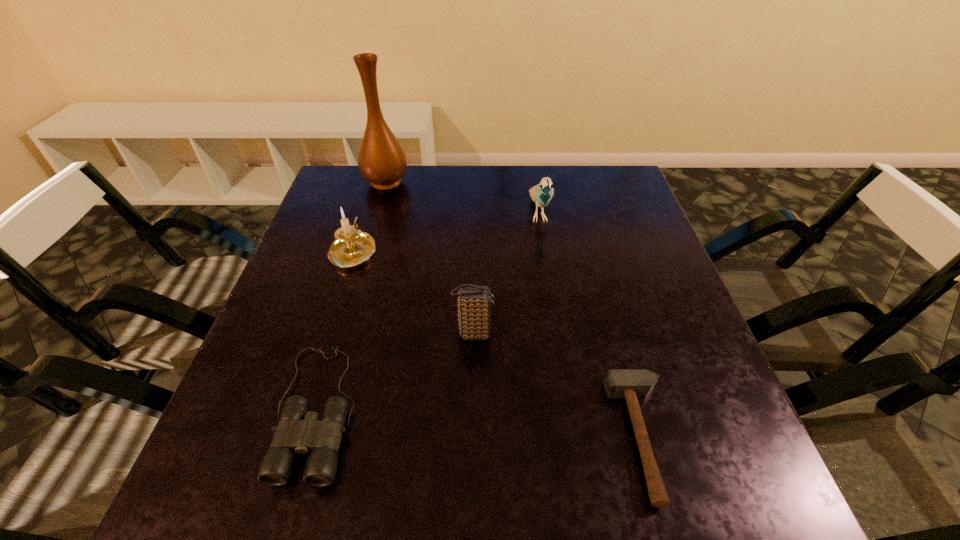
Locate an element on the screen. This screenshot has width=960, height=540. free space at the left edge of the desktop is located at coordinates (332, 233).

The image size is (960, 540). Find the location of `free region at the right edge of the desktop`. free region at the right edge of the desktop is located at coordinates (604, 215).

Image resolution: width=960 pixels, height=540 pixels. Find the location of `free region at the far left corner of the desktop`. free region at the far left corner of the desktop is located at coordinates (333, 186).

In the image, there is a desktop. Where is `vacant space at the far right corner`? vacant space at the far right corner is located at coordinates (575, 169).

The height and width of the screenshot is (540, 960). Identify the location of vacant area that lies between the clutch bag and the binoculars. click(x=396, y=372).

The width and height of the screenshot is (960, 540). What are the coordinates of `empty location between the binoculars and the bird` in the screenshot? It's located at (428, 311).

You are a GUI agent. You are given a task and a screenshot of the screen. Output one action in this format:
    pyautogui.click(x=<x>, y=<y>)
    Task: Click on the vacant area that lies between the bird and the fourth farthest object
    The image size is (960, 540).
    Given the screenshot: What is the action you would take?
    pyautogui.click(x=506, y=273)

At what (x,y) coordinates should I click in order to perform the action: click on unoccupied position between the hammer and the vase. Please return your answer as a coordinate pair (x, y). Looking at the image, I should click on (515, 309).

Where is `empty location between the vase and the hammer`? empty location between the vase and the hammer is located at coordinates (515, 309).

Locate an element on the screen. free spot between the hammer and the second shortest object is located at coordinates (480, 423).